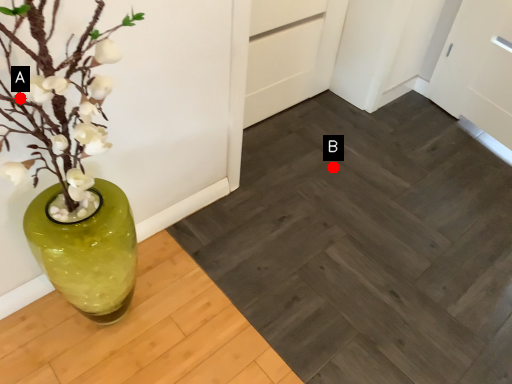
Question: Two points are circled on the image, labeled by A and B beside each circle. Which of the following is the closest to the observer?

Choices:
 (A) A is closer
 (B) B is closer

Answer: (A)